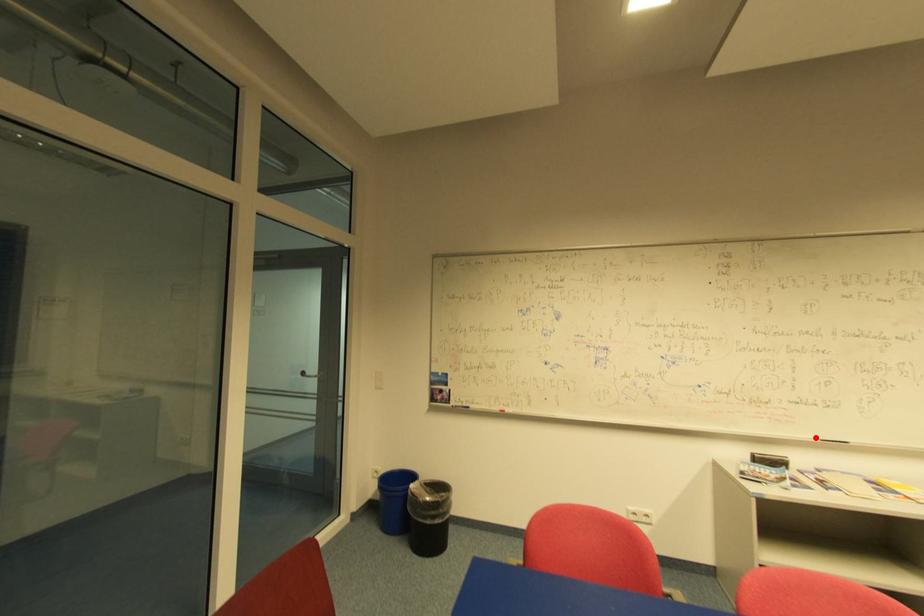
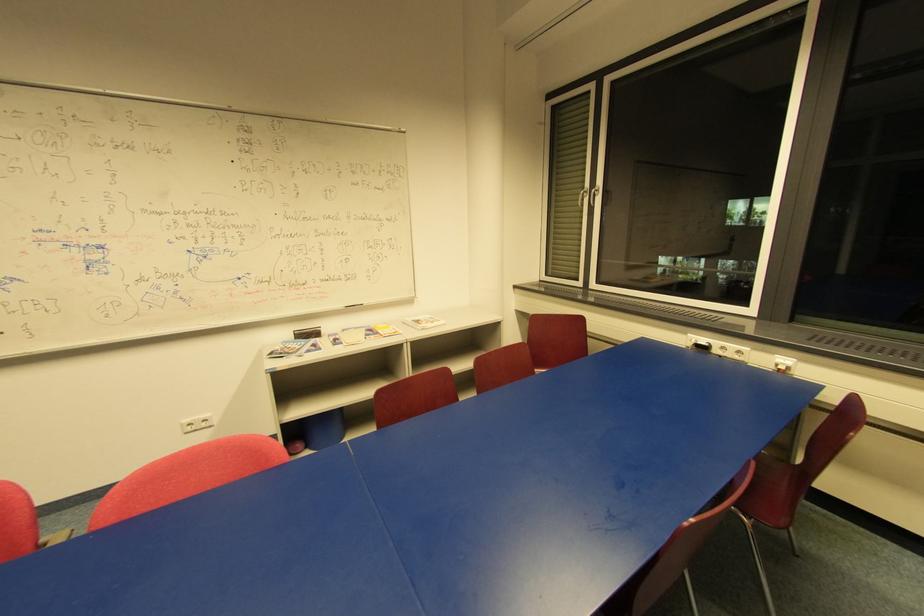
Where in the second image is the point corresponding to the highlighted location from the first image?

(344, 307)